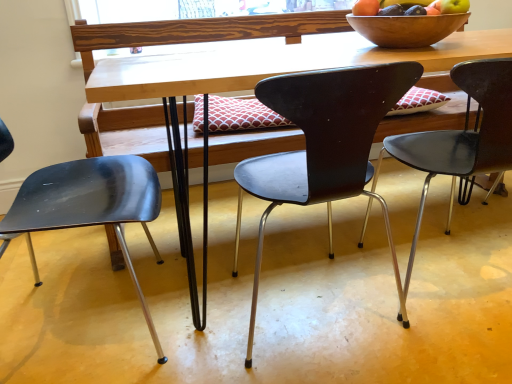
I want to click on free point to the left of matte black chair at center, marked as the 2th chair in a right-to-left arrangement, so click(x=201, y=302).